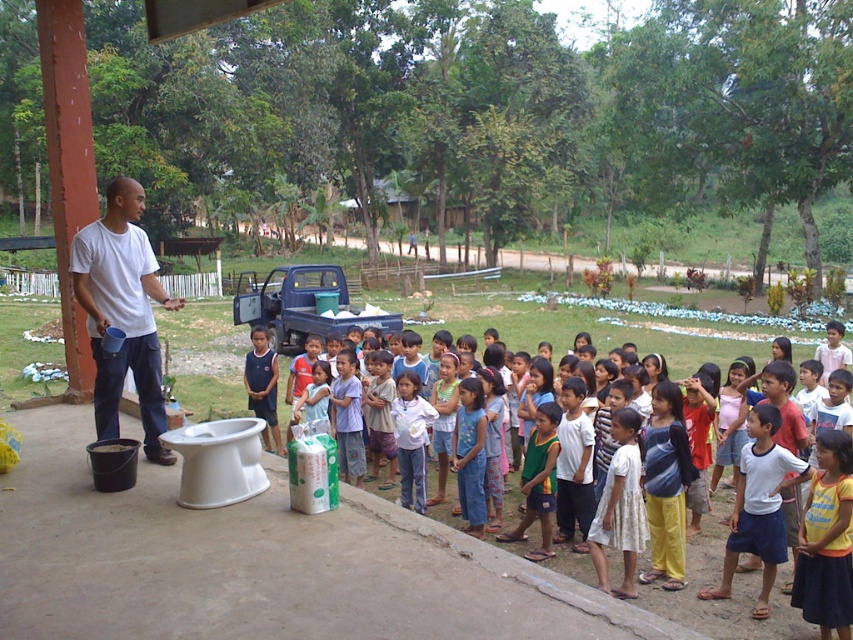
What are the coordinates of `white matte shirt at left` in the screenshot? It's located at (122, 312).

Can you confirm if white matte shirt at left is positioned below light blue denim shorts at center?

Actually, white matte shirt at left is above light blue denim shorts at center.

This screenshot has height=640, width=853. What do you see at coordinates (122, 312) in the screenshot?
I see `white matte shirt at left` at bounding box center [122, 312].

I want to click on white matte shirt at left, so click(122, 312).